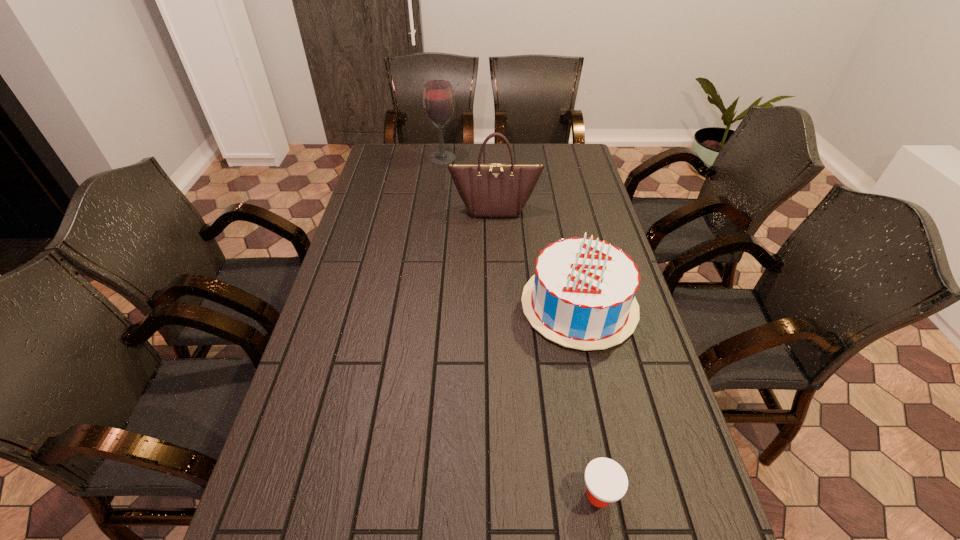
The width and height of the screenshot is (960, 540). I want to click on alcohol, so click(x=438, y=99).

The height and width of the screenshot is (540, 960). What are the coordinates of `the second farthest object` in the screenshot? It's located at (490, 189).

What are the coordinates of `birthday cake` in the screenshot? It's located at (582, 296).

You are a GUI agent. You are given a task and a screenshot of the screen. Output one action in this format:
    pyautogui.click(x=<x>, y=<y>)
    Task: Click on the second shortest object
    This screenshot has height=540, width=960.
    Given the screenshot: What is the action you would take?
    pyautogui.click(x=582, y=296)

I want to click on the shortest object, so click(606, 481).

Identify the location of the nearest object. This screenshot has height=540, width=960. (606, 481).

Where is `vacant space located on the right of the farthest object`? Image resolution: width=960 pixels, height=540 pixels. vacant space located on the right of the farthest object is located at coordinates (532, 158).

The image size is (960, 540). What are the coordinates of `vacant space located 0.140m on the front-facing side of the handbag` in the screenshot? It's located at (496, 244).

Locate an element on the screen. vacant area located 0.380m on the back of the third tallest object is located at coordinates (556, 199).

Find the location of a particular element. Image resolution: width=960 pixels, height=540 pixels. vacant space located on the left of the nearest object is located at coordinates (467, 495).